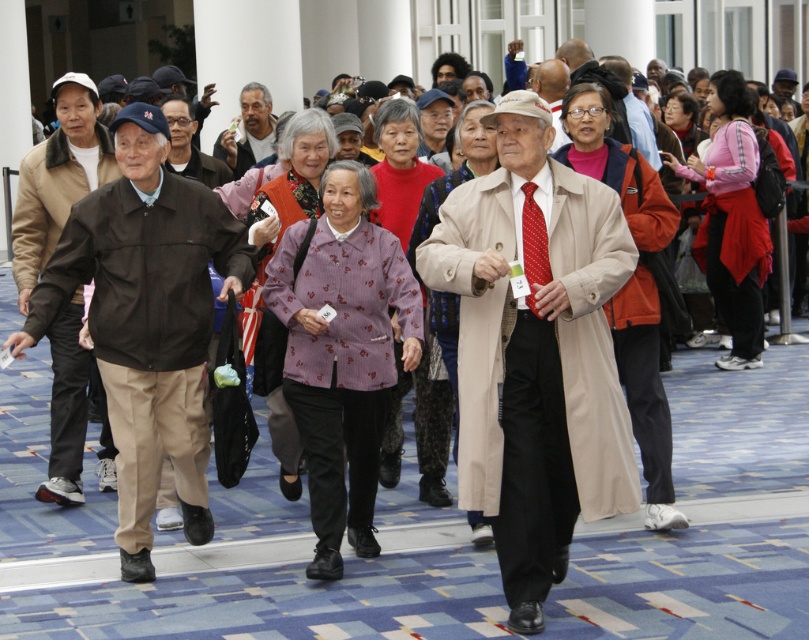
Question: Which point appears farthest from the camera in this image?

Choices:
 (A) pyautogui.click(x=142, y=168)
 (B) pyautogui.click(x=547, y=250)
 (C) pyautogui.click(x=246, y=122)

Answer: (C)

Question: Which is farther from the matte black jacket at left?

Choices:
 (A) matte brown jacket at left
 (B) matte brown jacket at center
 (C) red dotted tie at center

Answer: (C)

Question: Where is matte black jacket at left located in relation to red dotted tie at center in the image?

Choices:
 (A) below
 (B) above

Answer: (B)

Question: Can you confirm if matte brown jacket at left is positioned to the right of matte black jacket at left?

Choices:
 (A) yes
 (B) no

Answer: (A)

Question: Considering the real-world distances, which object is farthest from the matte brown jacket at center?

Choices:
 (A) beige wool coat at center
 (B) matte black jacket at left
 (C) matte brown jacket at left

Answer: (A)

Question: Can you confirm if matte black jacket at left is smaller than matte brown jacket at center?

Choices:
 (A) yes
 (B) no

Answer: (B)